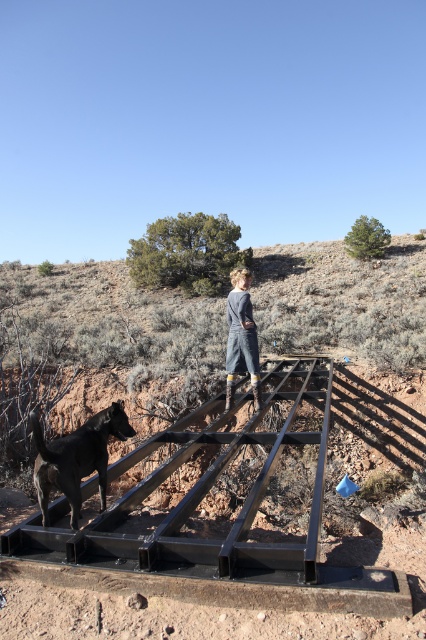
You are a construction worker planning to place a 3m wide equipment on the flat surface near the brown dirt hillside at upper center and the black metal rail at center. Which area can accommodate the equipment based on their widths?

The brown dirt hillside at upper center has a larger width than the black metal rail at center, so the equipment can be placed near the brown dirt hillside at upper center as it provides sufficient space.

You are a hiker trying to navigate to the shiny black dog at lower left. There is a brown dirt hillside at upper center in your way. Which direction should you move to avoid it?

The brown dirt hillside at upper center is to the left of the shiny black dog at lower left, so you should move to the right to avoid it.

You are standing in the dry landscape and see the shiny black dog at lower left and the denim dress at center. Which object is closer to the left edge of the scene?

The shiny black dog at lower left is closer to the left edge of the scene because it is positioned on the left side of the denim dress at center.